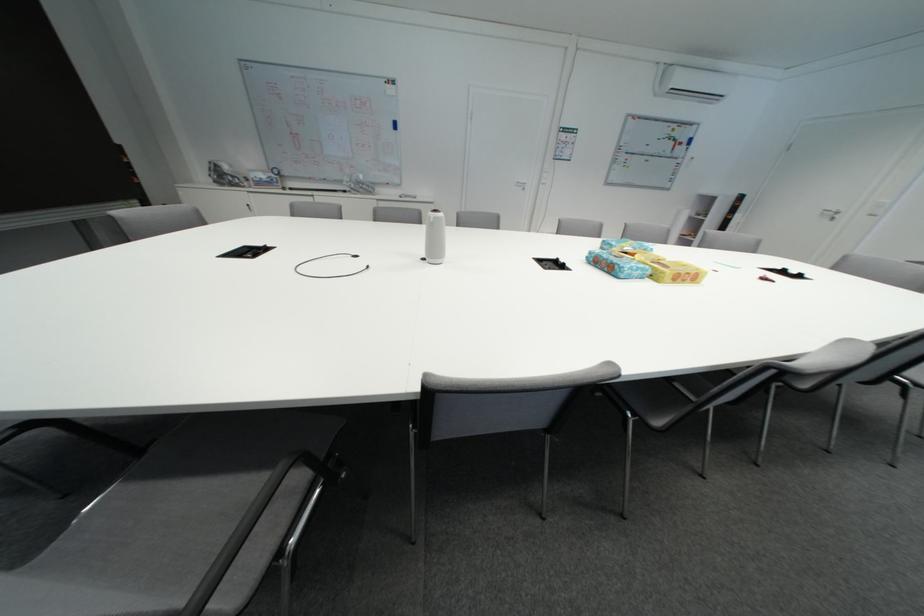
Where would you writ the red marker? Please return your answer as a coordinate pair (x, y).

(873, 92)